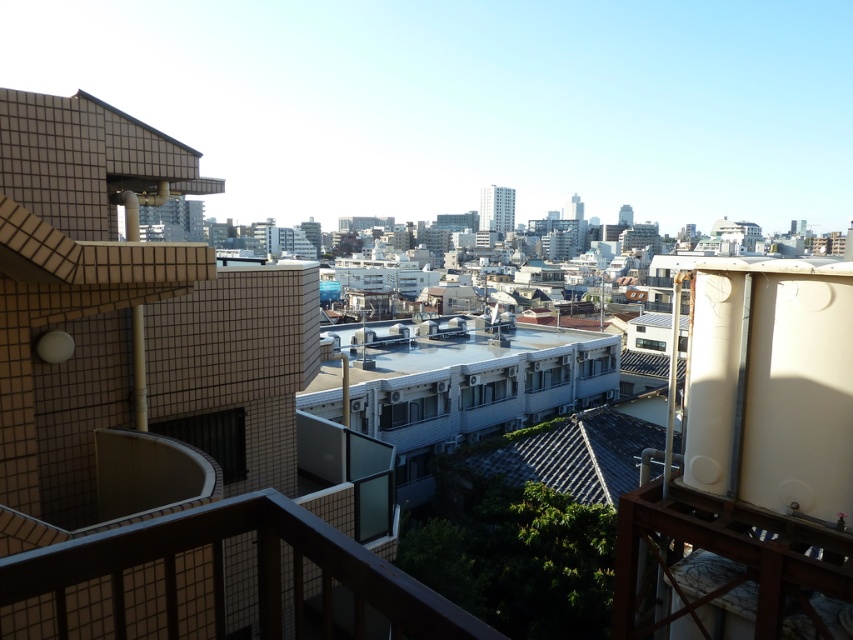
In the scene shown: You are a city planner reviewing this urban layout. You notice two roofs in the middle of the scene, the white smooth roof at center and the gray tile roof at center. Which one has a larger surface area?

The white smooth roof at center is bigger than the gray tile roof at center, so the white smooth roof at center has a larger surface area.

You are an architect assessing building heights in the urban scene. You observe the white smooth roof at center and the gray tile roof at center. Which roof is taller?

The white smooth roof at center is taller than the gray tile roof at center.

You are standing on the balcony and want to take a photo of both point (448, 408) and point (564, 486). Which point will appear closer to the front of the photo?

Point (448, 408) is further to the camera than point (564, 486), so in the photo, point (448, 408) will appear closer to the front of the photo.